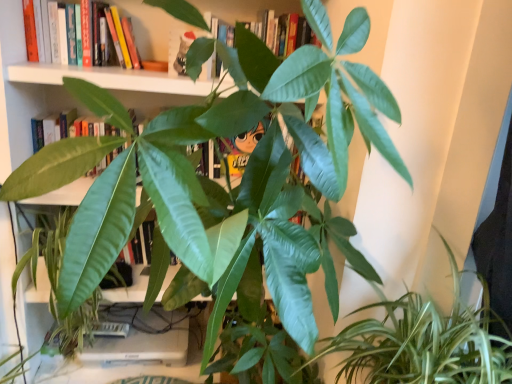
Question: Should I look upward or downward to see green glossy leafy plant at lower right?

Choices:
 (A) down
 (B) up

Answer: (A)

Question: From a real-world perspective, is green glossy leafy plant at lower right located beneath hardcover book at upper left?

Choices:
 (A) no
 (B) yes

Answer: (B)

Question: Considering the relative sizes of green glossy leafy plant at lower right and hardcover book at upper left in the image provided, is green glossy leafy plant at lower right shorter than hardcover book at upper left?

Choices:
 (A) yes
 (B) no

Answer: (B)

Question: Does green glossy leafy plant at lower right appear on the left side of hardcover book at upper left?

Choices:
 (A) no
 (B) yes

Answer: (A)

Question: From a real-world perspective, is green glossy leafy plant at lower right on hardcover book at upper left?

Choices:
 (A) yes
 (B) no

Answer: (B)

Question: Is green glossy leafy plant at lower right behind hardcover book at upper left?

Choices:
 (A) yes
 (B) no

Answer: (B)

Question: Does green glossy leafy plant at lower right touch hardcover book at upper left?

Choices:
 (A) yes
 (B) no

Answer: (B)

Question: From a real-world perspective, does hardcover book at upper left sit lower than green glossy leafy plant at lower right?

Choices:
 (A) no
 (B) yes

Answer: (A)

Question: From a real-world perspective, is hardcover book at upper left over green glossy leafy plant at lower right?

Choices:
 (A) no
 (B) yes

Answer: (B)

Question: Considering the relative positions of hardcover book at upper left and green glossy leafy plant at lower right in the image provided, is hardcover book at upper left to the left of green glossy leafy plant at lower right from the viewer's perspective?

Choices:
 (A) yes
 (B) no

Answer: (A)

Question: Is hardcover book at upper left turned away from green glossy leafy plant at lower right?

Choices:
 (A) no
 (B) yes

Answer: (A)

Question: From the image's perspective, is hardcover book at upper left on green glossy leafy plant at lower right?

Choices:
 (A) yes
 (B) no

Answer: (A)

Question: Is hardcover book at upper left next to green glossy leafy plant at lower right?

Choices:
 (A) yes
 (B) no

Answer: (B)

Question: In the image, is green glossy leafy plant at lower right positioned in front of or behind hardcover book at upper left?

Choices:
 (A) front
 (B) behind

Answer: (A)